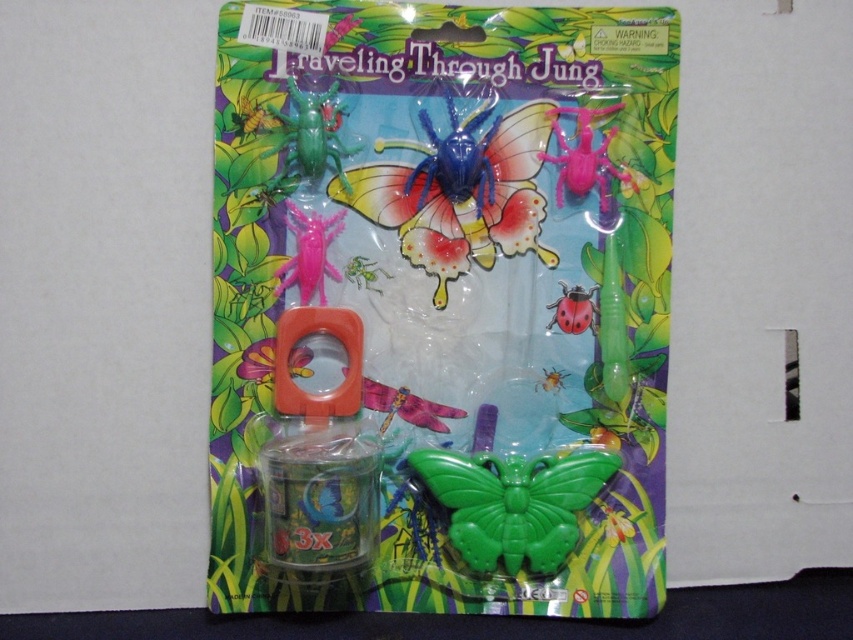
You are a child trying to decide which insect toy to pick first from the Traveling Through Jung blister pack. The green matte insect at upper center and the pink plastic spider at upper right are both visible. Which one do you think is taller?

The pink plastic spider at upper right is taller than the green matte insect at upper center.

You are a child trying to pick up the green matte insect at upper center and the pink plastic spider at upper right from the blister pack. Which toy is easier to grab first without moving your hand?

The green matte insect at upper center is closer to the viewer, so it is easier to grab first without moving your hand compared to the pink plastic spider at upper right.